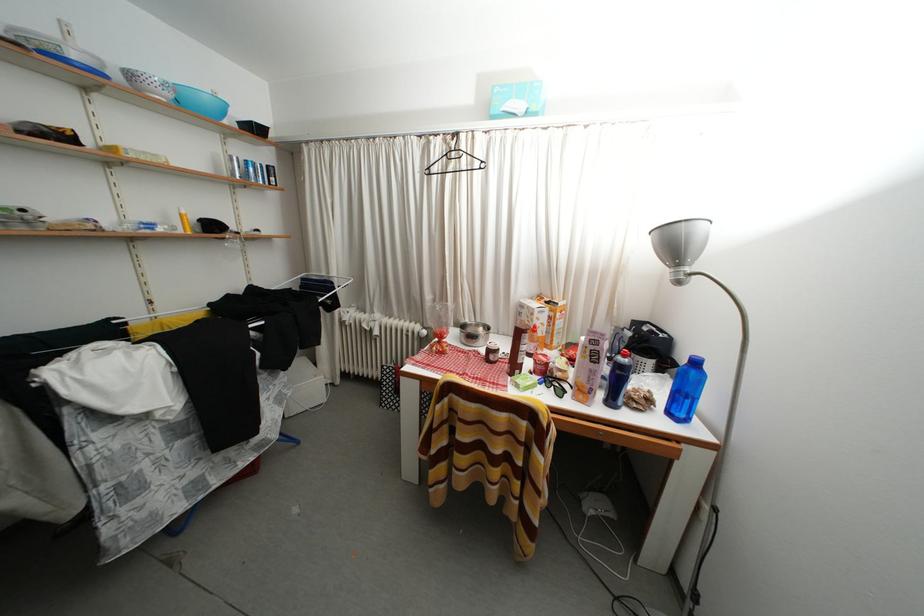
I want to click on light blue bowl, so click(200, 102).